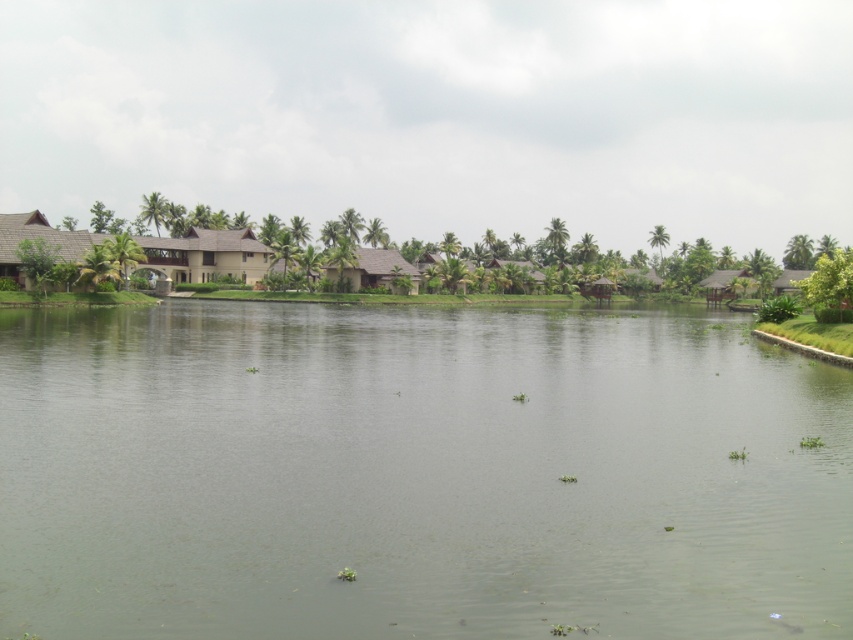
Who is positioned more to the right, green water at center or brown thatched hut at center?

green water at center

Which is more to the left, green water at center or brown thatched hut at center?

From the viewer's perspective, brown thatched hut at center appears more on the left side.

Is point (693, 621) closer to camera compared to point (326, 264)?

That is True.

Locate an element on the screen. Image resolution: width=853 pixels, height=640 pixels. green water at center is located at coordinates (416, 474).